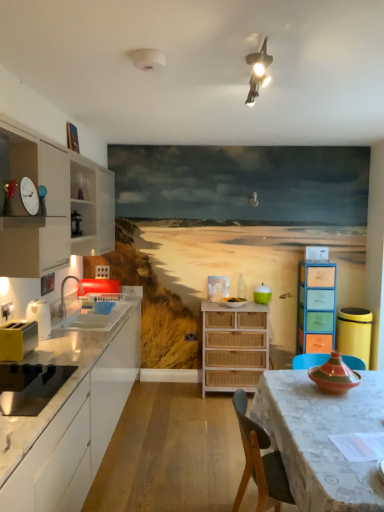
Where is `empty space that is ontop of white glossy toaster at left, which ranks as the 3th appliance in front-to-back order (from a real-world perspective)`? This screenshot has height=512, width=384. empty space that is ontop of white glossy toaster at left, which ranks as the 3th appliance in front-to-back order (from a real-world perspective) is located at coordinates (41, 296).